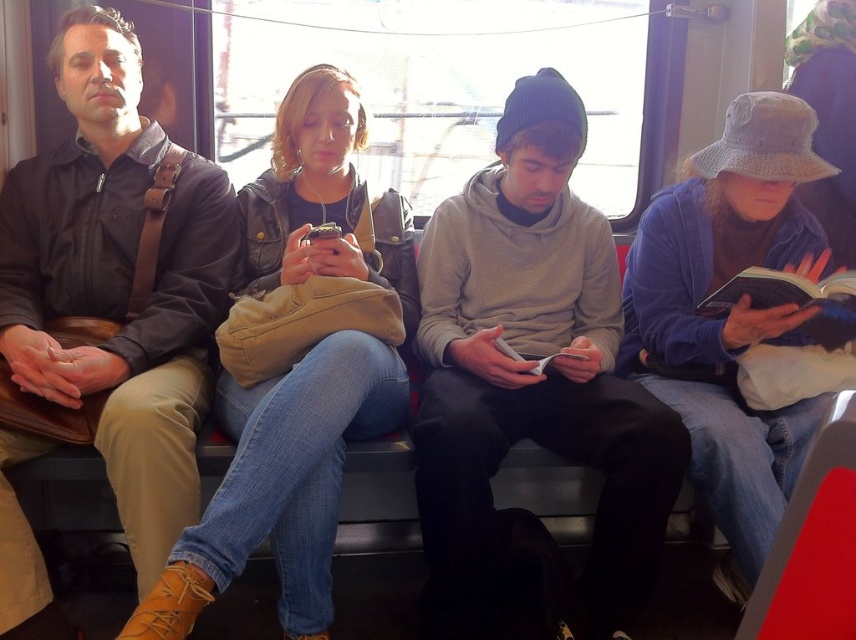
Between gray hoodie at center and brown leather jacket at left, which one has less height?

With less height is gray hoodie at center.

Can you confirm if gray hoodie at center is positioned above brown leather jacket at left?

No, gray hoodie at center is not above brown leather jacket at left.

What do you see at coordinates (532, 369) in the screenshot?
I see `gray hoodie at center` at bounding box center [532, 369].

This screenshot has width=856, height=640. Find the location of `gray hoodie at center`. gray hoodie at center is located at coordinates (532, 369).